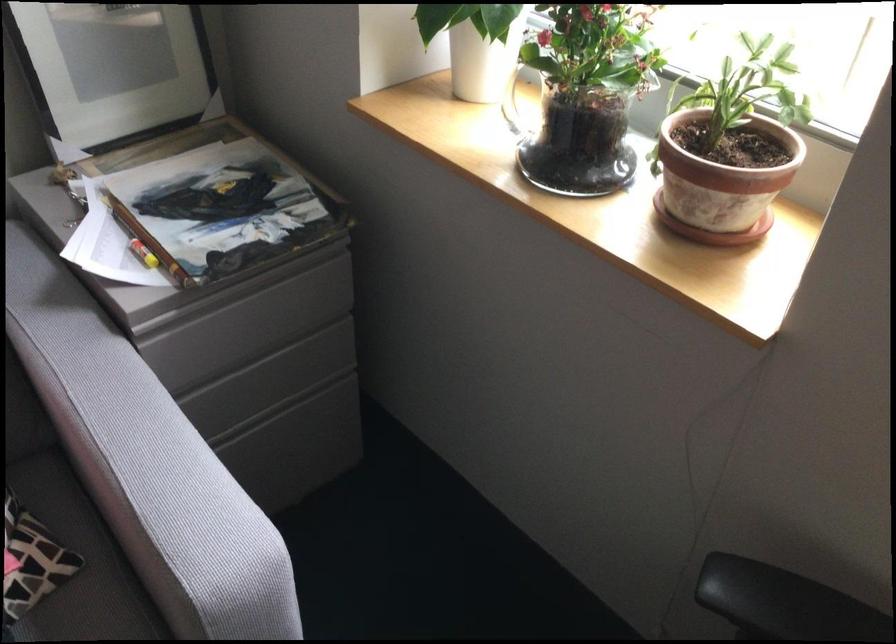
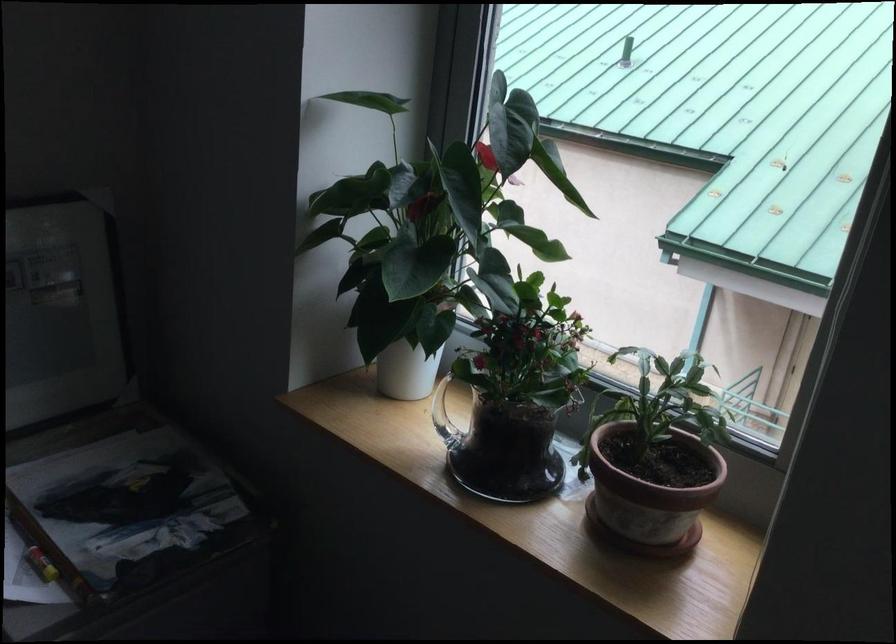
Question: Based on the continuous images, in which direction is the camera rotating? Reply with the corresponding letter.

Choices:
 (A) Left
 (B) Right
 (C) Up
 (D) Down

Answer: (C)